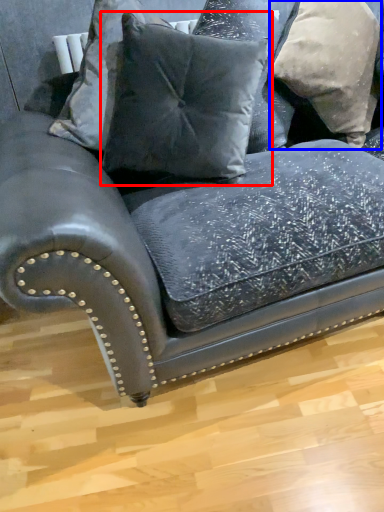
Question: Which object is further to the camera taking this photo, pillow (highlighted by a red box) or pillow (highlighted by a blue box)?

Choices:
 (A) pillow
 (B) pillow

Answer: (B)